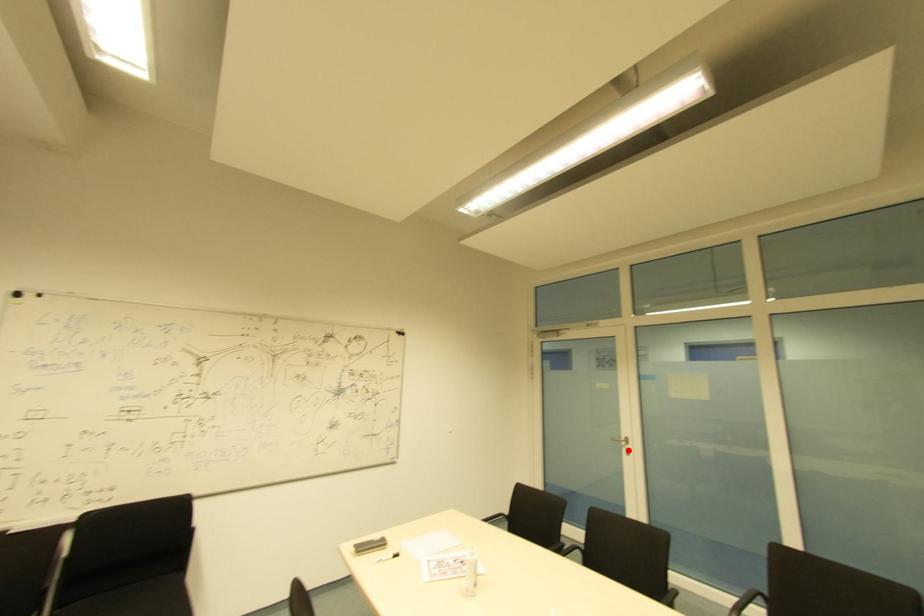
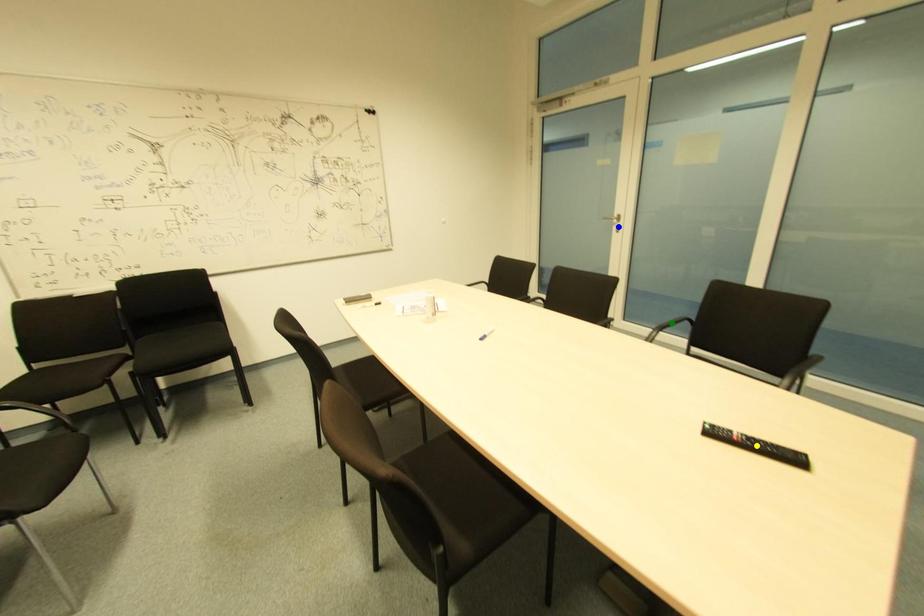
Question: I am providing you with two images of the same scene from different viewpoints. A red point is marked on the first image. You are given multiple points on the second image. Which mark in image 2 goes with the point in image 1?

Choices:
 (A) blue point
 (B) yellow point
 (C) green point

Answer: (A)